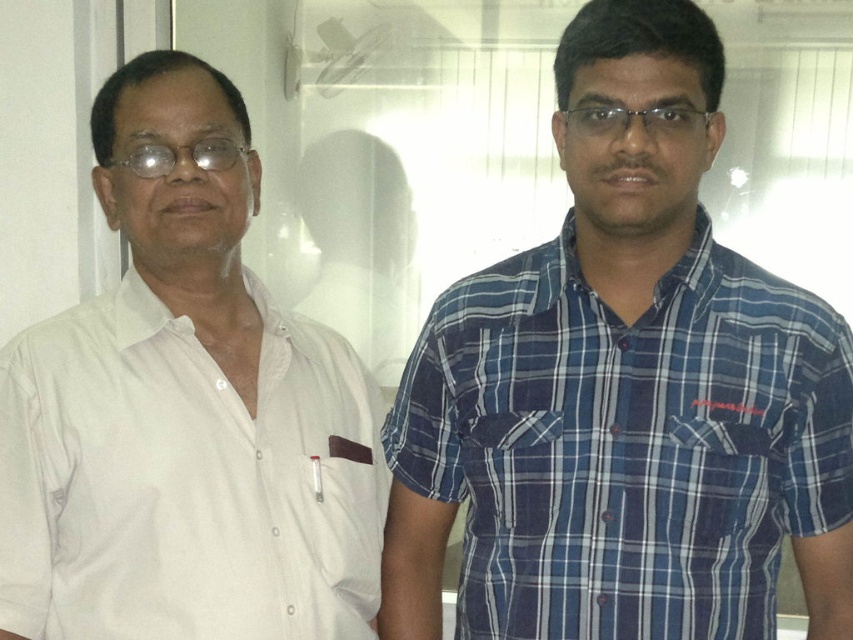
You are an office worker who needs to pass between the white cotton shirt at left and the blue plaid shirt at right to reach the exit. The path between them is narrow. Can you walk through it if you keep to the left side of the path?

The white cotton shirt at left is to the left of the blue plaid shirt at right, so walking to the left side of the path between them should allow you to pass through without obstruction.

You are an interior designer assessing the layout of this office. You notice the white cotton shirt at left and the blue plaid shirt at right. Which of these shirts is taller in the image?

The white cotton shirt at left is taller than the blue plaid shirt at right.